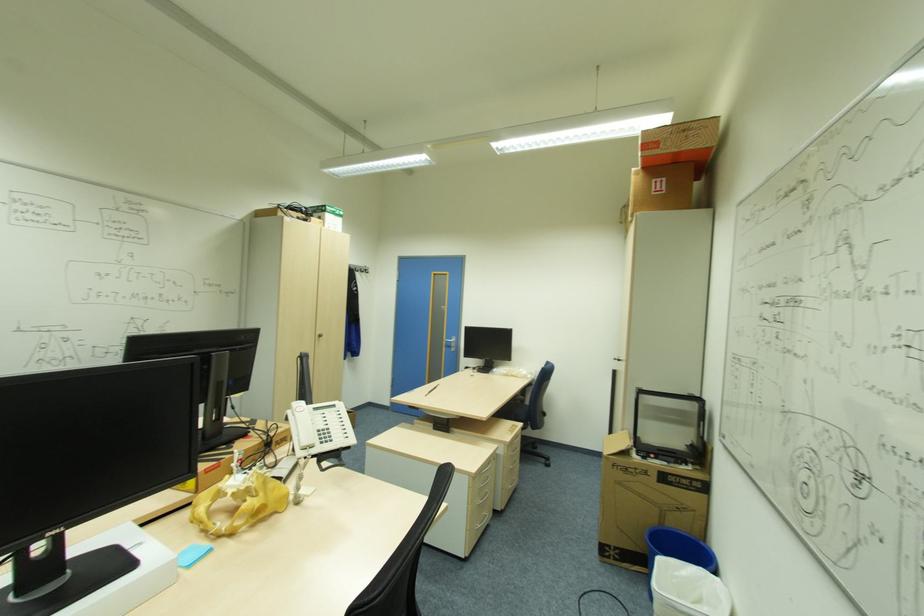
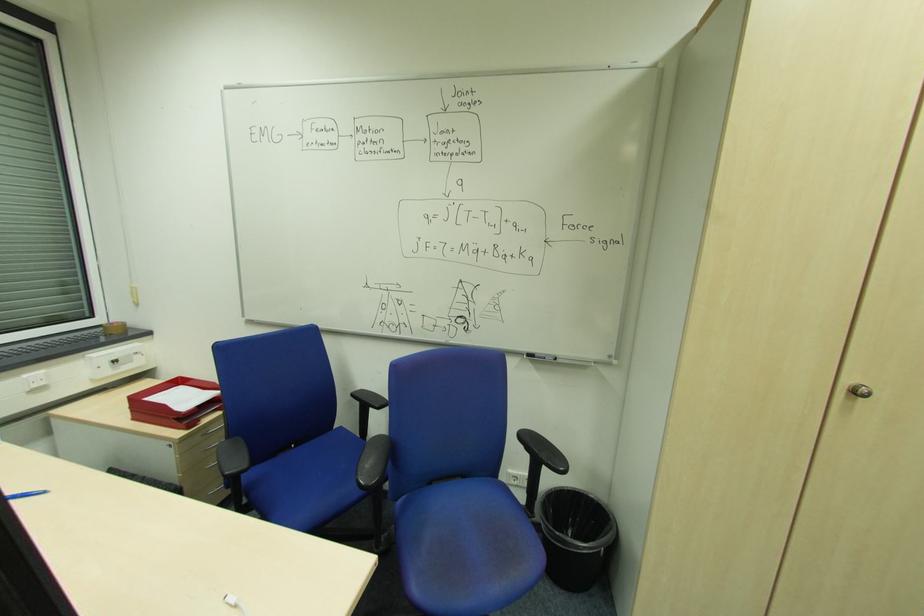
Find the pixel in the second image that matches pixel 322 334 in the first image.

(860, 392)